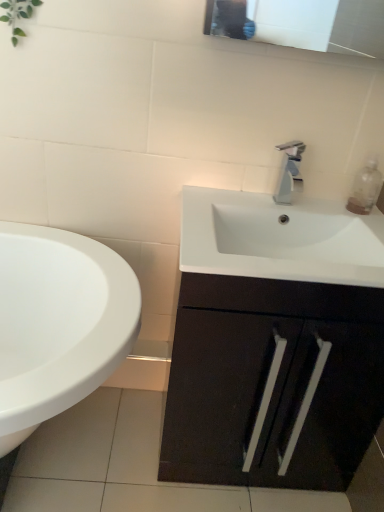
Where is `vacant space that is in between silver metallic faucet at center and clear plastic bottle at upper right`? vacant space that is in between silver metallic faucet at center and clear plastic bottle at upper right is located at coordinates (320, 207).